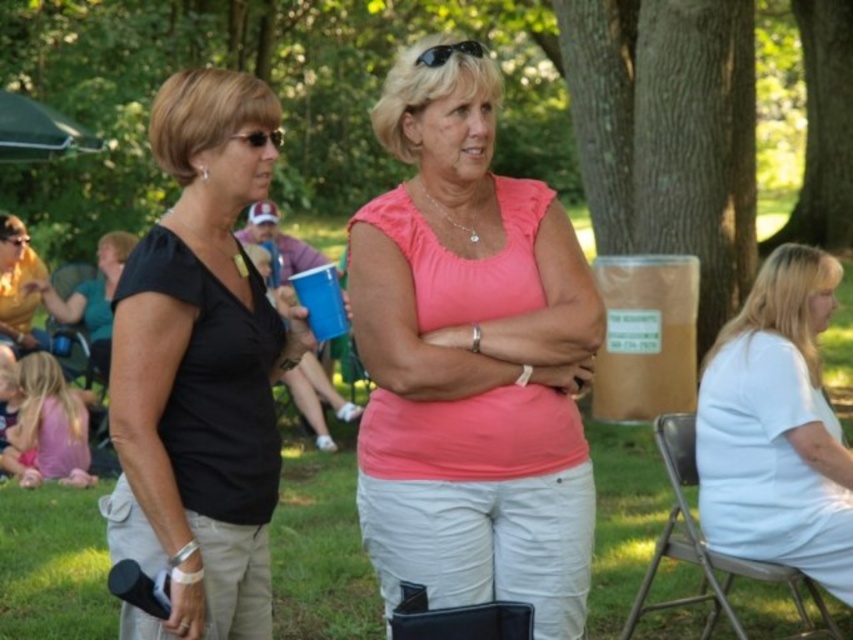
You are a photographer trying to capture a closeup of the sunglasses at center without the green leafy tree at upper center blocking the view. Is this possible given their positions?

The green leafy tree at upper center is further to the viewer than sunglasses at center, so the tree would block the direct line of sight to the sunglasses. To capture a clear closeup of the sunglasses at center without obstruction, you would need to adjust your angle or position to avoid the tree.

You are planning to take a photo of the green leafy tree at upper center and the sunglasses at center. Which object should you focus on first if you want to capture both in a single frame without moving the camera?

You should focus on the green leafy tree at upper center first because it is larger in size than the sunglasses at center, making it the more prominent subject to frame properly.

You are a photographer setting up for an event in the park. You notice the black matte shirt at left and the metallic silver folding chair at lower right. Which object is closer to the camera based on their positions?

The black matte shirt at left is closer to the camera because it is positioned over the metallic silver folding chair at lower right, indicating it is in front spatially.